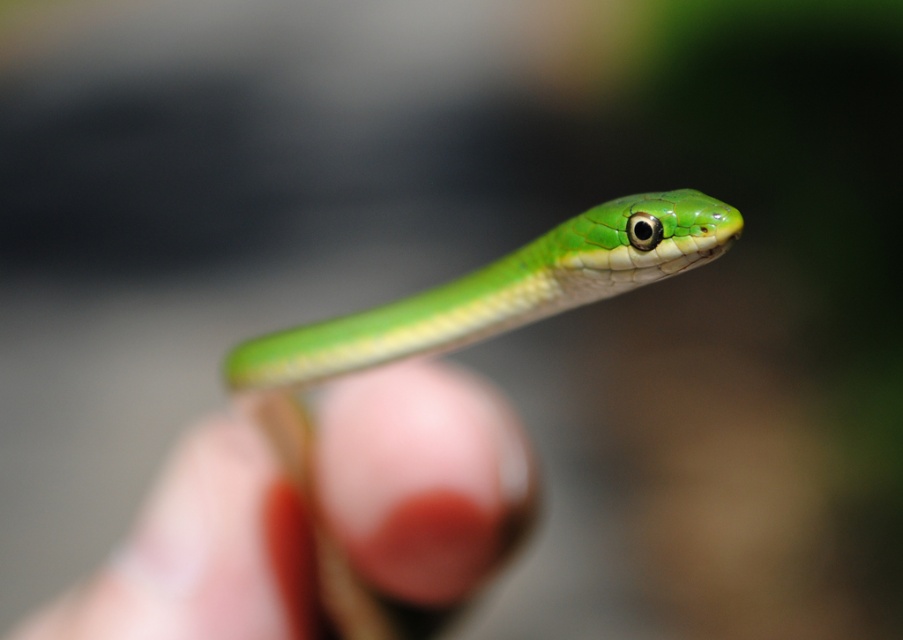
You are a biologist examining a snake in a terrarium. You notice two objects at the center of the enclosure. One is the green smooth skin at center and the other is the green smooth snake at center. Which object is larger?

The green smooth skin at center is bigger than the green smooth snake at center according to the description provided.

From the picture: Based on the scene description, can you identify the object located at the coordinates point (424, 477)?

The object at point (424, 477) is the green smooth skin at center.

Looking at the image of a snake in someone hands, you notice two objects labeled as green smooth skin at center and green smooth snake at center. Which one is positioned to the left?

The green smooth skin at center is positioned to the left of the green smooth snake at center.